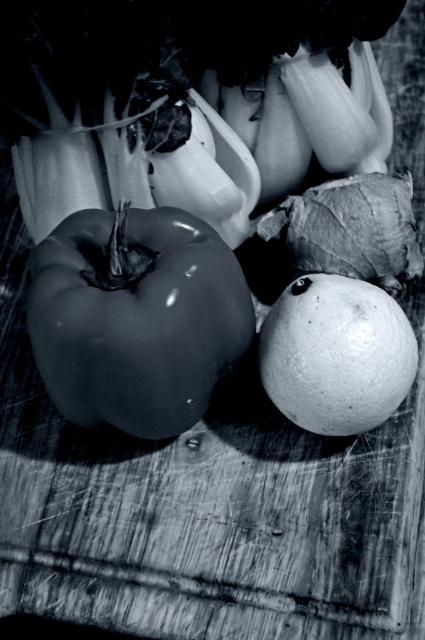
Who is more distant from viewer, (184, 218) or (367, 288)?

Point (367, 288)

Who is more forward, (104, 355) or (311, 348)?

Point (104, 355) is in front.

At what (x,y) coordinates should I click in order to perform the action: click on glossy black pepper at left. Please return your answer as a coordinate pair (x, y). Looking at the image, I should click on (136, 317).

I want to click on glossy black pepper at left, so click(x=136, y=317).